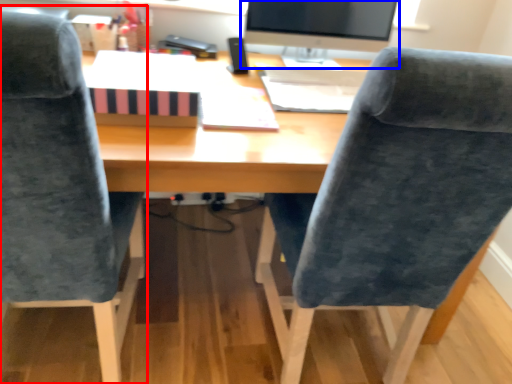
Question: Which object is further to the camera taking this photo, chair (highlighted by a red box) or computer monitor (highlighted by a blue box)?

Choices:
 (A) chair
 (B) computer monitor

Answer: (B)